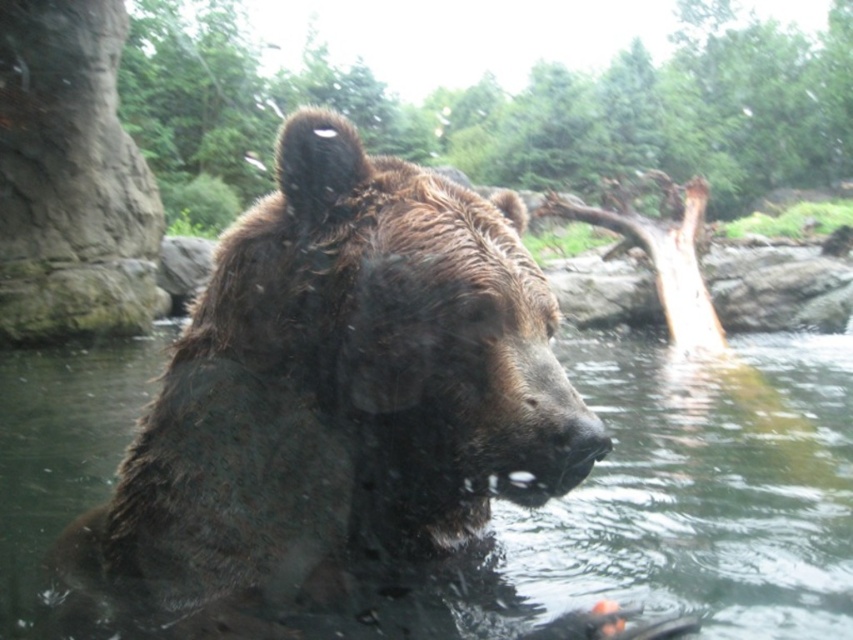
Is wet fur bear at center shorter than brown wet fur at center?

No, wet fur bear at center is not shorter than brown wet fur at center.

Can you confirm if wet fur bear at center is bigger than brown wet fur at center?

No, wet fur bear at center is not bigger than brown wet fur at center.

Is point (358, 344) positioned before point (460, 595)?

Yes, it is in front of point (460, 595).

Identify the location of wet fur bear at center. (341, 390).